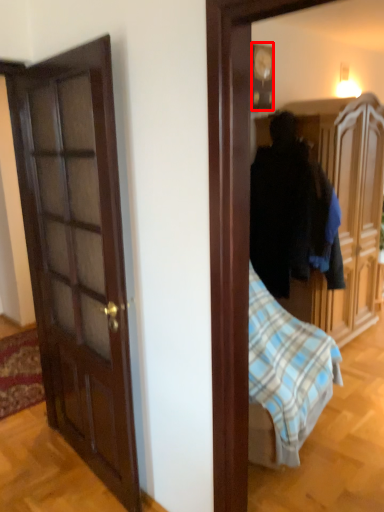
Question: From the image's perspective, what is the correct spatial positioning of picture frame (annotated by the red box) in reference to cabinetry?

Choices:
 (A) above
 (B) below

Answer: (A)